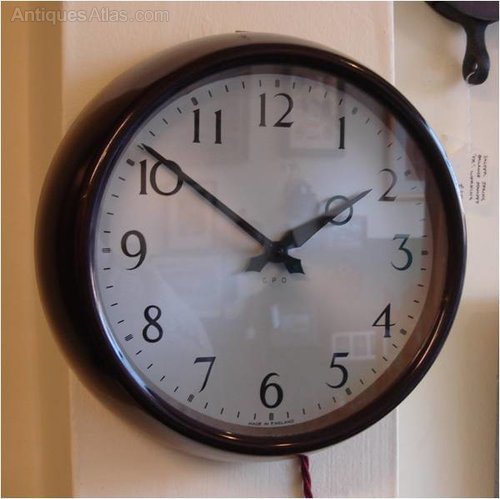
This screenshot has width=500, height=499. In order to click on hanging dark gray cast iron skillet in this screenshot , I will do `click(483, 16)`.